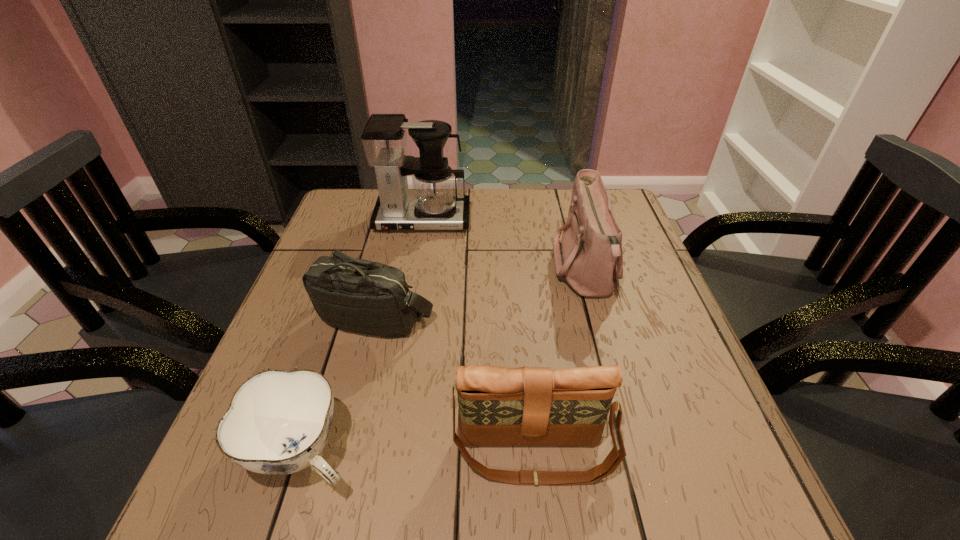
You are a GUI agent. You are given a task and a screenshot of the screen. Output one action in this format:
    pyautogui.click(x=<x>, y=<y>)
    Task: Click on the vacant space at the near left corner of the desktop
    The height and width of the screenshot is (540, 960).
    Given the screenshot: What is the action you would take?
    pyautogui.click(x=282, y=510)

At what (x,y) coordinates should I click in order to perform the action: click on vacant space at the near right corner of the desktop. Please return your answer as a coordinate pair (x, y). Looking at the image, I should click on (687, 494).

You are a GUI agent. You are given a task and a screenshot of the screen. Output one action in this format:
    pyautogui.click(x=<x>, y=<y>)
    Task: Click on the free spot between the leftmost shoulder bag and the chinaware
    Image resolution: width=960 pixels, height=540 pixels.
    Given the screenshot: What is the action you would take?
    pyautogui.click(x=339, y=386)

Locate an element on the screen. This screenshot has width=960, height=540. vacant area that lies between the nearest shoulder bag and the chinaware is located at coordinates (419, 453).

Point out which object is positioned as the fourth nearest to the nearest shoulder bag. Please provide its 2D coordinates. Your answer should be formatted as a tuple, i.e. [(x, y)], where the tuple contains the x and y coordinates of a point satisfying the conditions above.

[(434, 205)]

Where is `object that stands as the second closest to the nearest shoulder bag`? object that stands as the second closest to the nearest shoulder bag is located at coordinates (x=357, y=295).

Locate an element on the screen. shoulder bag identified as the second closest to the coffee maker is located at coordinates (357, 295).

At what (x,y) coordinates should I click in order to perform the action: click on shoulder bag that is the second closest to the leftmost shoulder bag. Please return your answer as a coordinate pair (x, y). The image size is (960, 540). Looking at the image, I should click on [x=589, y=258].